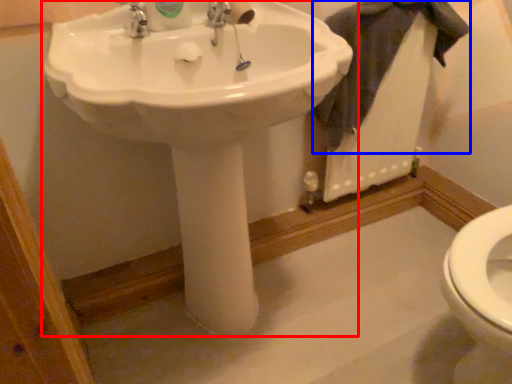
Question: Which object appears closest to the camera in this image, sink (highlighted by a red box) or bath towel (highlighted by a blue box)?

Choices:
 (A) sink
 (B) bath towel

Answer: (A)